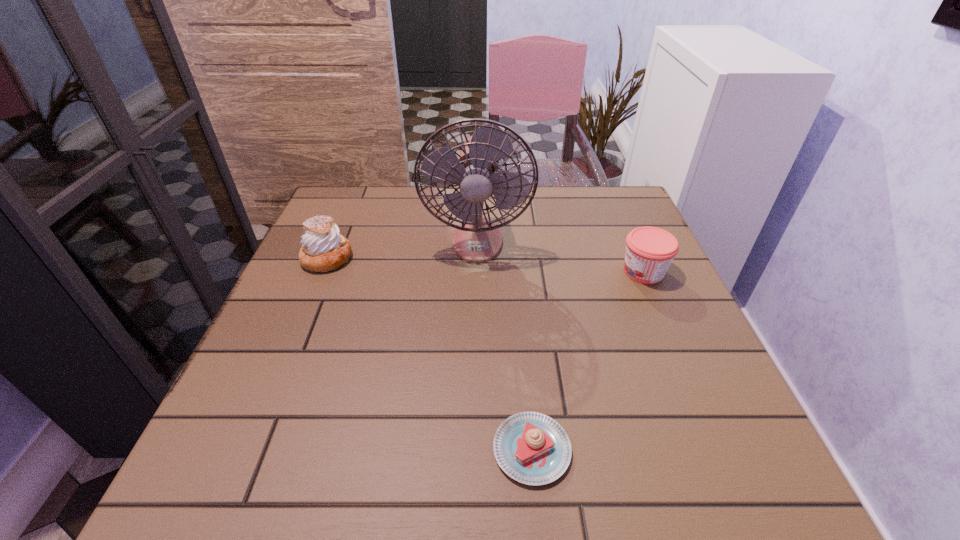
Find the location of a particular element. The height and width of the screenshot is (540, 960). vacant space at the right edge of the desktop is located at coordinates (669, 352).

Identify the location of vacant space at the far left corner. This screenshot has height=540, width=960. (338, 195).

Where is `free space at the near left corner of the desktop`? free space at the near left corner of the desktop is located at coordinates (289, 502).

Where is `vacant area at the far right corner`? This screenshot has width=960, height=540. vacant area at the far right corner is located at coordinates (609, 197).

You are a GUI agent. You are given a task and a screenshot of the screen. Output one action in this format:
    pyautogui.click(x=<x>, y=<y>)
    Task: Click on the empty space that is in between the second shortest object and the taller pastry
    
    Given the screenshot: What is the action you would take?
    pyautogui.click(x=486, y=265)

Where is `free point between the shortest object and the fan`? free point between the shortest object and the fan is located at coordinates (504, 345).

Locate an element on the screen. This screenshot has width=960, height=540. free area in between the tallest object and the jam is located at coordinates (561, 256).

Identify the location of free area in between the second shortest object and the fan. The width and height of the screenshot is (960, 540). (561, 256).

The width and height of the screenshot is (960, 540). In order to click on free space between the nearest object and the fan in this screenshot , I will do click(504, 345).

What are the coordinates of `vacant space that's between the shorter pastry and the third tallest object` in the screenshot? It's located at (588, 361).